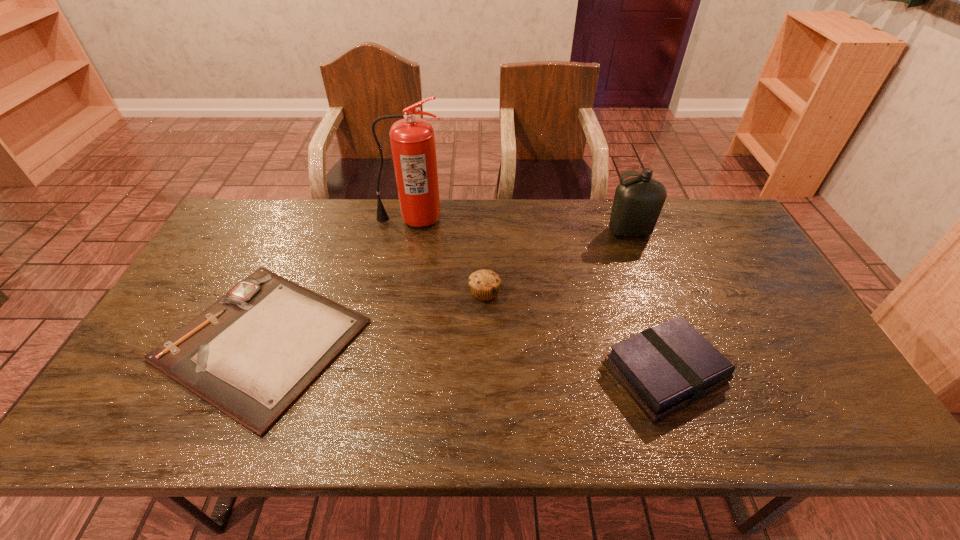
Locate which object is the fourth closest to the book. Please provide its 2D coordinates. Your answer should be formatted as a tuple, i.e. [(x, y)], where the tuple contains the x and y coordinates of a point satisfying the conditions above.

[(252, 353)]

Where is `object identified as the second closest to the tallest object`? This screenshot has width=960, height=540. object identified as the second closest to the tallest object is located at coordinates (484, 284).

The image size is (960, 540). I want to click on free space that satisfies the following two spatial constraints: 1. on the instruction side of the tallest object; 2. on the right side of the third object from left to right, so click(398, 292).

The image size is (960, 540). Find the location of `blank space that satisfies the following two spatial constraints: 1. on the instruction side of the muffin; 2. on the right side of the tallest object`. blank space that satisfies the following two spatial constraints: 1. on the instruction side of the muffin; 2. on the right side of the tallest object is located at coordinates (398, 292).

Image resolution: width=960 pixels, height=540 pixels. In order to click on vacant space that satisfies the following two spatial constraints: 1. on the instruction side of the tallest object; 2. on the left side of the fourth shortest object in this screenshot , I will do `click(409, 232)`.

In order to click on vacant space that satisfies the following two spatial constraints: 1. on the instruction side of the tallest object; 2. on the left side of the muffin in this screenshot , I will do `click(398, 292)`.

At what (x,y) coordinates should I click in order to perform the action: click on blank space that satisfies the following two spatial constraints: 1. on the instruction side of the fire extinguisher; 2. on the left side of the book. Please return your answer as a coordinate pair (x, y). Image resolution: width=960 pixels, height=540 pixels. Looking at the image, I should click on (385, 372).

This screenshot has width=960, height=540. In order to click on vacant point that satisfies the following two spatial constraints: 1. on the back side of the shortest object; 2. on the right side of the third object from left to right in this screenshot , I will do `click(283, 292)`.